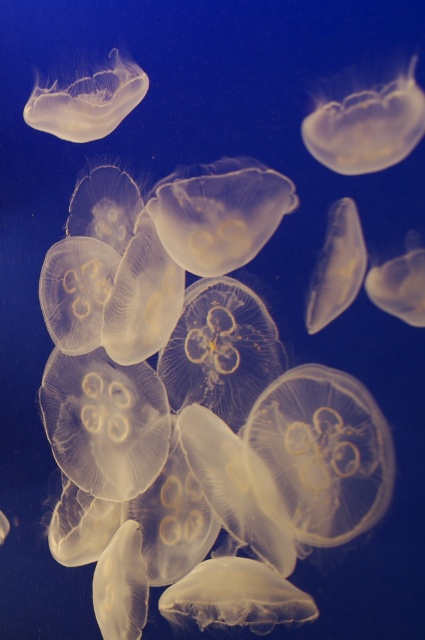
Is translucent gelatinous at upper left below translucent gelatinous at center?

Actually, translucent gelatinous at upper left is above translucent gelatinous at center.

How distant is translucent gelatinous at upper left from translucent gelatinous at center?

translucent gelatinous at upper left and translucent gelatinous at center are 55.12 centimeters apart.

Between point (74, 128) and point (329, 291), which one is positioned in front?

Point (329, 291) is in front.

Where is `translucent gelatinous at upper left`? The height and width of the screenshot is (640, 425). translucent gelatinous at upper left is located at coordinates (87, 100).

What do you see at coordinates (367, 125) in the screenshot? I see `translucent gelatinous at upper center` at bounding box center [367, 125].

Is point (388, 106) positioned behind point (317, 259)?

No, (388, 106) is in front of (317, 259).

This screenshot has height=640, width=425. I want to click on translucent gelatinous at upper center, so click(367, 125).

Is translucent gelatinous at upper center wider than translucent gelatinous at upper left?

Incorrect, translucent gelatinous at upper center's width does not surpass translucent gelatinous at upper left's.

Who is higher up, translucent gelatinous at upper center or translucent gelatinous at upper left?

Positioned higher is translucent gelatinous at upper left.

Between point (373, 124) and point (93, 97), which one is positioned in front?

Point (373, 124)

Where is `translucent gelatinous at upper center`? translucent gelatinous at upper center is located at coordinates (367, 125).